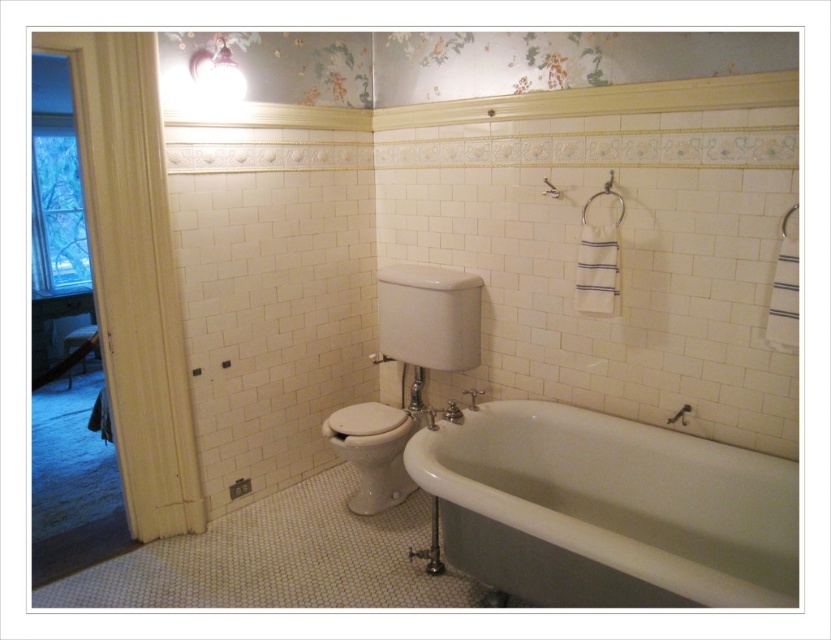
You are planning to install a new showerhead in the bathroom. The showerhead requires a minimum of 80 cm of space between the shower area and any nearby fixtures. Given the current layout, can the showerhead be safely installed near the white porcelain bathtub at lower right and the matte white light fixture at upper center?

The white porcelain bathtub at lower right has a larger width than the matte white light fixture at upper center, but the exact dimensions are not provided. However, since the bathtub is at lower right and the light fixture is at upper center, their positions suggest they are not directly adjacent. The showerhead installation would depend on the actual distance between them, which isn

You are standing in the vintage bathroom and need to locate the matte white light fixture at upper center. According to the scene description, where would you find it?

The matte white light fixture at upper center is located at point (217, 72), so you can find it there.